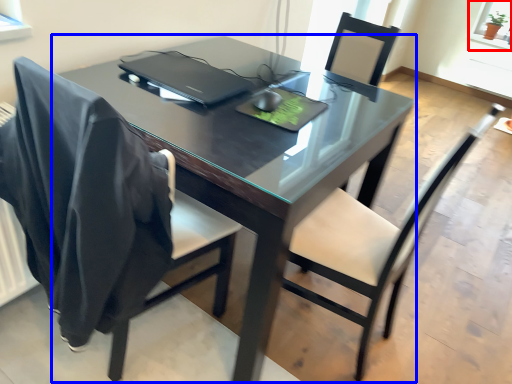
Question: Which point is further to the camera, window screen (highlighted by a red box) or table (highlighted by a blue box)?

Choices:
 (A) window screen
 (B) table

Answer: (A)